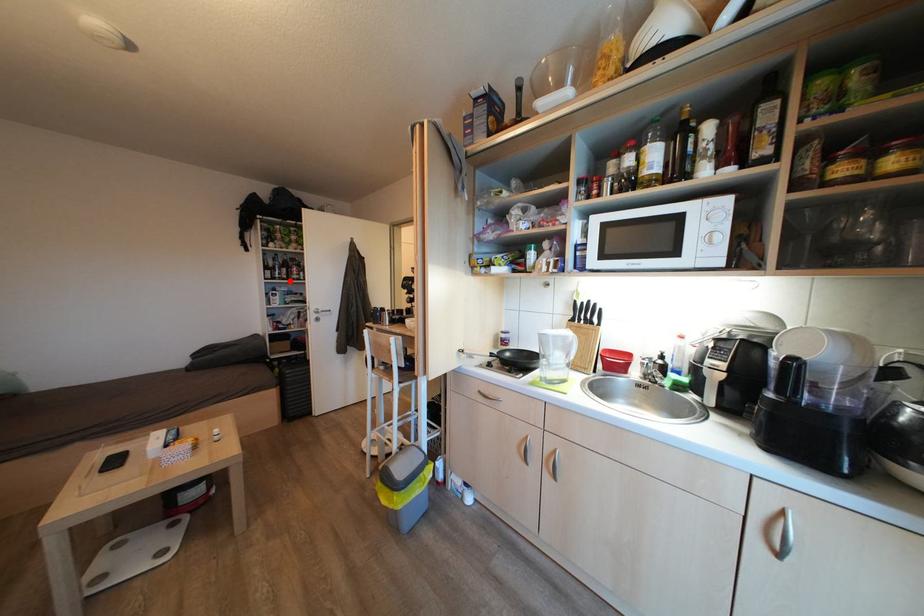
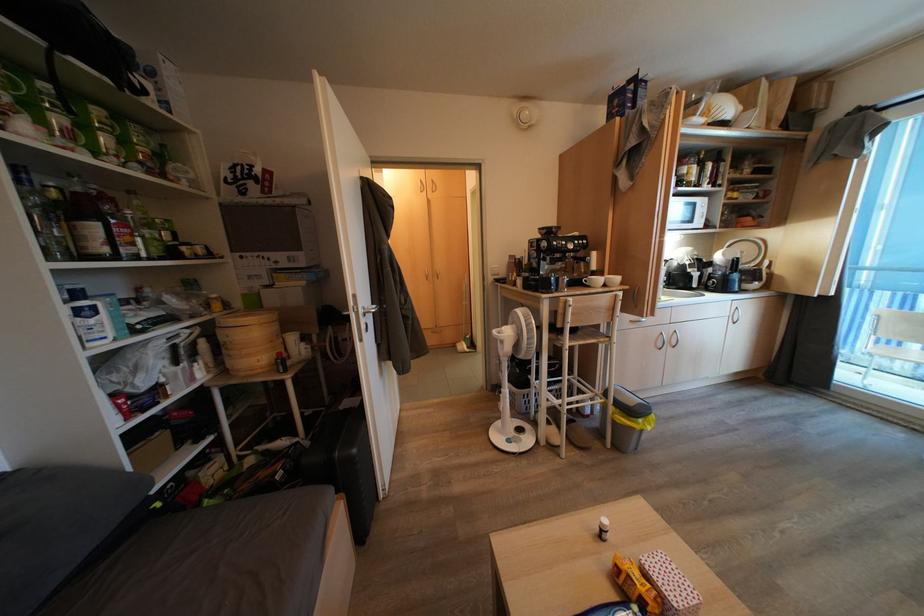
Locate, in the second image, the point that corresponds to the highlighted location in the first image.

(111, 254)